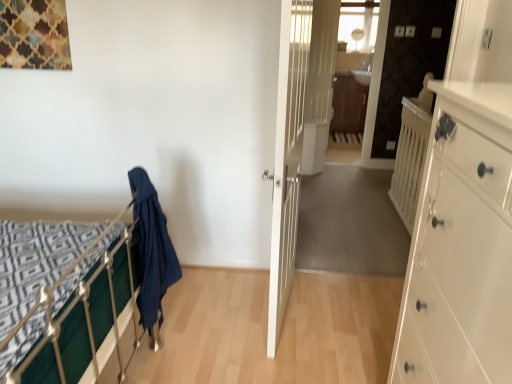
Identify the location of free region on the left part of white wooden door at center, which appears as the 1th door when viewed from the left. This screenshot has width=512, height=384. [220, 306].